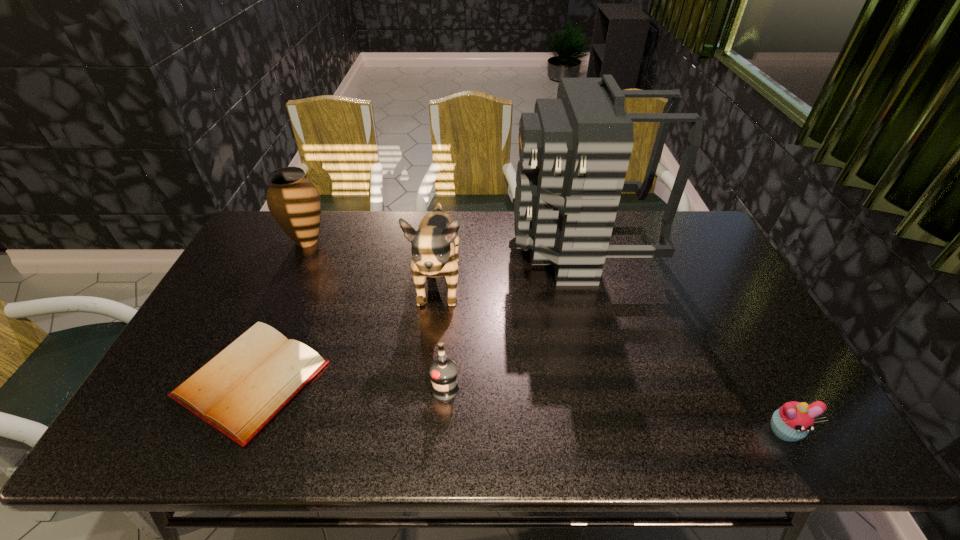
You are a GUI agent. You are given a task and a screenshot of the screen. Output one action in this format:
    pyautogui.click(x=<x>, y=<y>)
    Task: Click on the urn located at the left edge
    This screenshot has width=960, height=540.
    Given the screenshot: What is the action you would take?
    pyautogui.click(x=293, y=200)

Locate an element on the screen. This screenshot has height=540, width=960. Bible that is at the left edge is located at coordinates (239, 391).

Locate an element on the screen. This screenshot has width=960, height=540. object located at the right edge is located at coordinates (792, 421).

Where is `object present at the far left corner`? This screenshot has width=960, height=540. object present at the far left corner is located at coordinates (293, 200).

Locate an element on the screen. The height and width of the screenshot is (540, 960). object located at the near left corner is located at coordinates (239, 391).

At what (x,y) coordinates should I click in order to perform the action: click on object that is at the near right corner. Please return your answer as a coordinate pair (x, y). The image size is (960, 540). Looking at the image, I should click on (792, 421).

This screenshot has height=540, width=960. Identify the location of free region at the far edge of the desktop. (444, 212).

Find the location of a particular element. The image size is (960, 540). vacant space at the near edge is located at coordinates (416, 416).

This screenshot has width=960, height=540. What are the coordinates of `vacant space at the near left corner of the desktop` in the screenshot? It's located at (148, 417).

I want to click on blank space at the far right corner of the desktop, so click(689, 214).